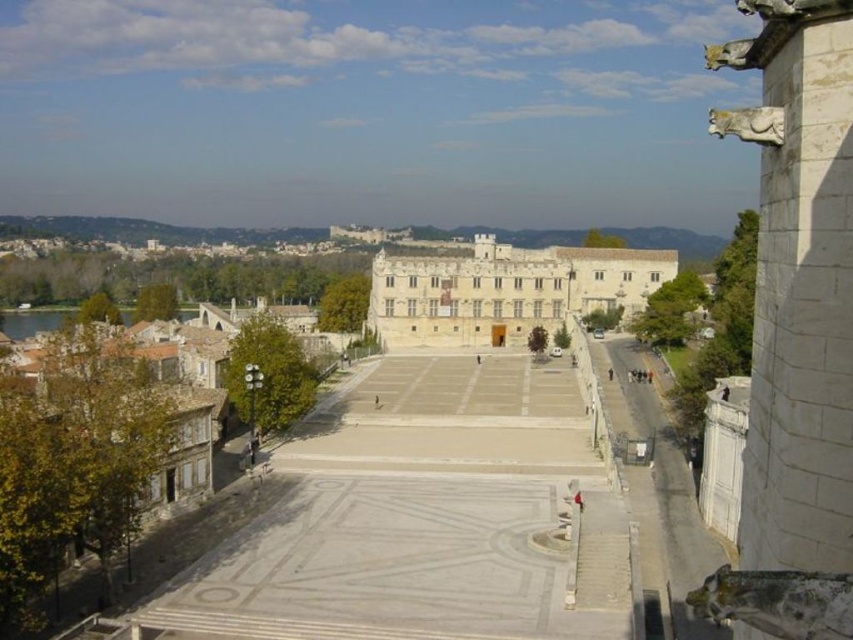
Does white stone gargoyle at right have a greater width compared to white stone palace at center?

Incorrect, white stone gargoyle at right's width does not surpass white stone palace at center's.

Who is taller, white stone gargoyle at right or white stone palace at center?

Standing taller between the two is white stone gargoyle at right.

Is point (824, 136) positioned before point (647, 278)?

That is True.

You are a GUI agent. You are given a task and a screenshot of the screen. Output one action in this format:
    pyautogui.click(x=<x>, y=<y>)
    Task: Click on the white stone gargoyle at right
    The height and width of the screenshot is (640, 853).
    Given the screenshot: What is the action you would take?
    pyautogui.click(x=798, y=284)